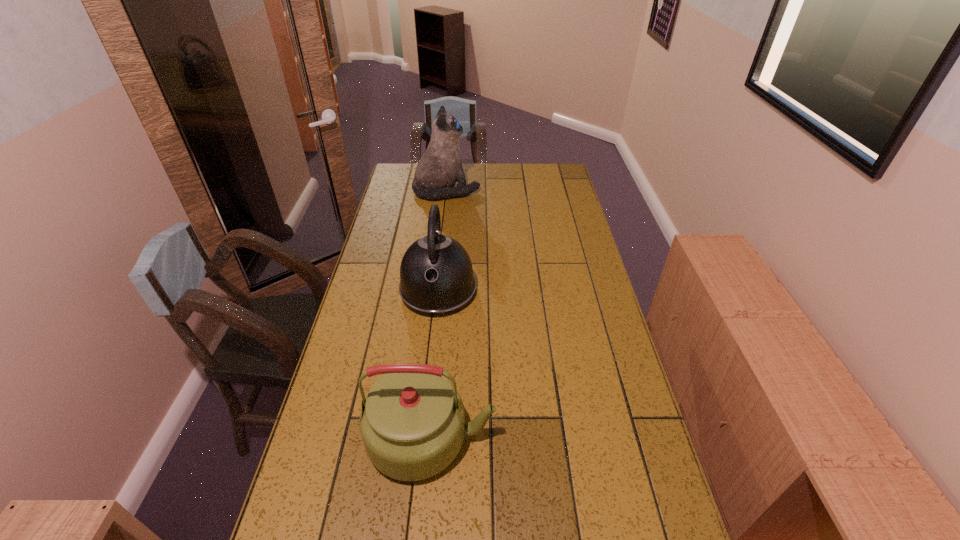
This screenshot has width=960, height=540. What are the coordinates of `blank space at the left edge of the desktop` in the screenshot? It's located at (357, 286).

At what (x,y) coordinates should I click in order to perform the action: click on vacant region at the right edge of the desktop. Please return your answer as a coordinate pair (x, y). Looking at the image, I should click on (591, 429).

The width and height of the screenshot is (960, 540). In the image, there is a desktop. What are the coordinates of `vacant space at the far left corner` in the screenshot? It's located at (403, 166).

The width and height of the screenshot is (960, 540). Identify the location of vacant area at the far right corner. (549, 180).

The height and width of the screenshot is (540, 960). Identify the location of free space that is in between the nearer kettle and the farther kettle. (435, 364).

I want to click on free space between the nearest object and the farther kettle, so click(x=435, y=364).

The height and width of the screenshot is (540, 960). What are the coordinates of `vacant region between the second nearest object and the nearest object` in the screenshot? It's located at (435, 364).

Locate an element on the screen. vacant area that lies between the farther kettle and the nearer kettle is located at coordinates (435, 364).

You are a GUI agent. You are given a task and a screenshot of the screen. Output one action in this format:
    pyautogui.click(x=<x>, y=<y>)
    Task: Click on the empty location between the farther kettle and the nearest object
    The height and width of the screenshot is (540, 960).
    Given the screenshot: What is the action you would take?
    pyautogui.click(x=435, y=364)

Locate an element on the screen. the closest object to the nearer kettle is located at coordinates (436, 276).